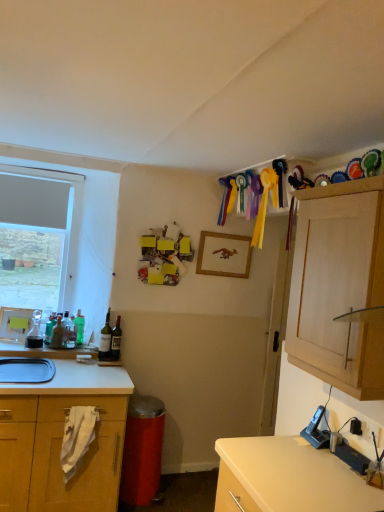
Question: From the image's perspective, is translucent glass bottle at left, which is the 2th bottle from left to right, on top of white laminate countertop at lower left?

Choices:
 (A) yes
 (B) no

Answer: (A)

Question: Is translucent glass bottle at left, the 5th bottle viewed from the right, oriented towards white laminate countertop at lower left?

Choices:
 (A) no
 (B) yes

Answer: (A)

Question: Considering the relative sizes of translucent glass bottle at left, the 5th bottle viewed from the right, and white laminate countertop at lower left in the image provided, is translucent glass bottle at left, the 5th bottle viewed from the right, smaller than white laminate countertop at lower left?

Choices:
 (A) no
 (B) yes

Answer: (B)

Question: Is translucent glass bottle at left, the 5th bottle viewed from the right, to the left of white laminate countertop at lower left from the viewer's perspective?

Choices:
 (A) no
 (B) yes

Answer: (A)

Question: From the image's perspective, is translucent glass bottle at left, which is the 2th bottle from left to right, located beneath white laminate countertop at lower left?

Choices:
 (A) yes
 (B) no

Answer: (B)

Question: Considering their positions, is matte glass bottle at center left, the 2th bottle from the right, located in front of or behind translucent glass carafe at left, arranged as the 6th bottle when viewed from the right?

Choices:
 (A) behind
 (B) front

Answer: (A)

Question: Looking at their shapes, would you say matte glass bottle at center left, the 2th bottle from the right, is wider or thinner than translucent glass carafe at left, arranged as the 6th bottle when viewed from the right?

Choices:
 (A) wide
 (B) thin

Answer: (B)

Question: From the image's perspective, is matte glass bottle at center left, arranged as the fifth bottle when viewed from the left, above or below translucent glass carafe at left, arranged as the 6th bottle when viewed from the right?

Choices:
 (A) below
 (B) above

Answer: (A)

Question: From a real-world perspective, is matte glass bottle at center left, the 2th bottle from the right, above or below translucent glass carafe at left, arranged as the 6th bottle when viewed from the right?

Choices:
 (A) below
 (B) above

Answer: (B)

Question: In the image, is translucent glass carafe at left, arranged as the 6th bottle when viewed from the right, positioned in front of or behind translucent glass bottle at left, which is the third bottle from left to right?

Choices:
 (A) front
 (B) behind

Answer: (A)

Question: Looking at their shapes, would you say translucent glass carafe at left, arranged as the first bottle when viewed from the left, is wider or thinner than translucent glass bottle at left, which is the third bottle from left to right?

Choices:
 (A) thin
 (B) wide

Answer: (B)

Question: Is translucent glass carafe at left, arranged as the 6th bottle when viewed from the right, inside or outside of translucent glass bottle at left, which is the third bottle from left to right?

Choices:
 (A) outside
 (B) inside

Answer: (A)

Question: From a real-world perspective, is translucent glass carafe at left, arranged as the 6th bottle when viewed from the right, above or below translucent glass bottle at left, which is the third bottle from left to right?

Choices:
 (A) above
 (B) below

Answer: (A)

Question: Looking at their shapes, would you say matte glass bottle at center left, arranged as the fifth bottle when viewed from the left, is wider or thinner than matte white sink at lower left?

Choices:
 (A) wide
 (B) thin

Answer: (B)

Question: Considering the positions of matte glass bottle at center left, arranged as the fifth bottle when viewed from the left, and matte white sink at lower left in the image, is matte glass bottle at center left, arranged as the fifth bottle when viewed from the left, taller or shorter than matte white sink at lower left?

Choices:
 (A) short
 (B) tall

Answer: (B)